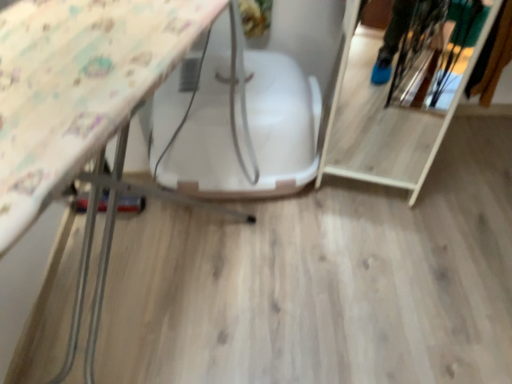
Question: From a real-world perspective, is white plastic swivel chair at center on wooden shelf at right?

Choices:
 (A) no
 (B) yes

Answer: (A)

Question: Is white plastic swivel chair at center oriented away from wooden shelf at right?

Choices:
 (A) no
 (B) yes

Answer: (A)

Question: Could you tell me if white plastic swivel chair at center is facing wooden shelf at right?

Choices:
 (A) yes
 (B) no

Answer: (B)

Question: Is white plastic swivel chair at center smaller than wooden shelf at right?

Choices:
 (A) yes
 (B) no

Answer: (B)

Question: Can you see white plastic swivel chair at center touching wooden shelf at right?

Choices:
 (A) no
 (B) yes

Answer: (A)

Question: Does white plastic swivel chair at center come in front of wooden shelf at right?

Choices:
 (A) no
 (B) yes

Answer: (A)

Question: Could you tell me if wooden shelf at right is turned towards white plastic swivel chair at center?

Choices:
 (A) no
 (B) yes

Answer: (A)

Question: From a real-world perspective, is wooden shelf at right over white plastic swivel chair at center?

Choices:
 (A) yes
 (B) no

Answer: (A)

Question: From the image's perspective, would you say wooden shelf at right is positioned over white plastic swivel chair at center?

Choices:
 (A) yes
 (B) no

Answer: (A)

Question: Does wooden shelf at right have a larger size compared to white plastic swivel chair at center?

Choices:
 (A) no
 (B) yes

Answer: (A)

Question: Is wooden shelf at right beside white plastic swivel chair at center?

Choices:
 (A) no
 (B) yes

Answer: (A)

Question: Is wooden shelf at right oriented away from white plastic swivel chair at center?

Choices:
 (A) no
 (B) yes

Answer: (A)

Question: From the image's perspective, is wooden shelf at right above or below white plastic swivel chair at center?

Choices:
 (A) below
 (B) above

Answer: (B)